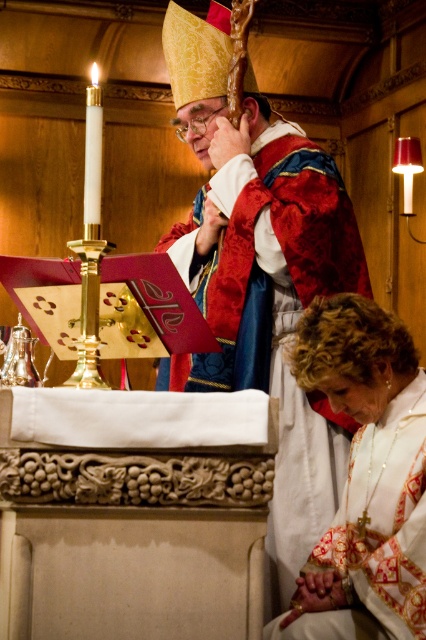
Who is shorter, velvet red robe at center or white embroidered robe at lower right?

white embroidered robe at lower right is shorter.

Is velvet red robe at center smaller than white embroidered robe at lower right?

Actually, velvet red robe at center might be larger than white embroidered robe at lower right.

Between point (241, 220) and point (402, 577), which one is positioned behind?

Point (241, 220)

At what (x,y) coordinates should I click in order to perform the action: click on velvet red robe at center. Please return your answer as a coordinate pair (x, y). Looking at the image, I should click on (275, 316).